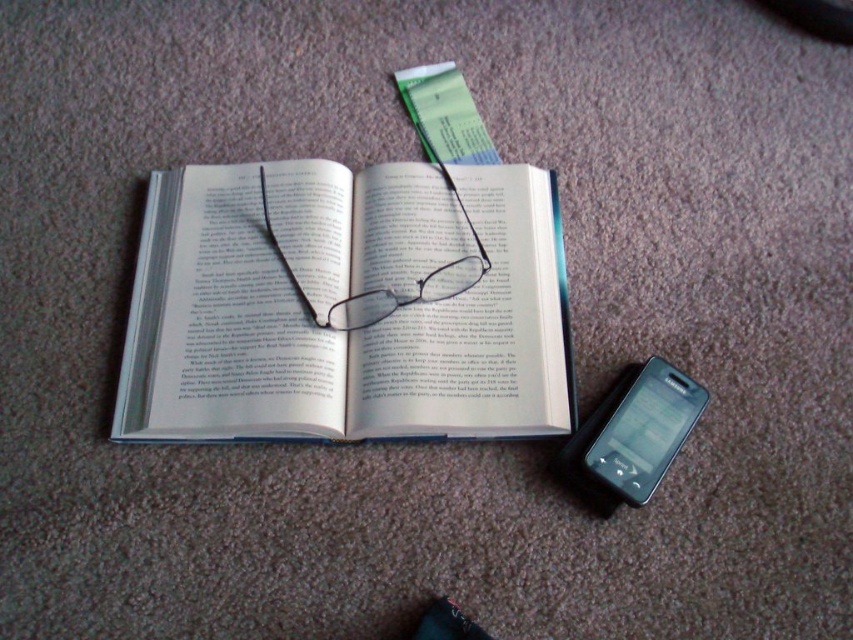
You are standing 1 meter away from a point marked at coordinates point [206,428]. Can you reach the point without moving your feet?

The distance of point [206,428] from viewer is 1.13 meters, so you are 0.13 meters too far to reach it without moving your feet.

From the picture: You are organizing items on a desk and need to place a new object between the white paper at center and the matte black smartphone at lower right. Based on their positions, which item is closer to you, and thus where should you position the new object?

The white paper at center is closer to you than the matte black smartphone at lower right. To place the new object between them, position it closer to the matte black smartphone at lower right since the white paper is nearer to you.